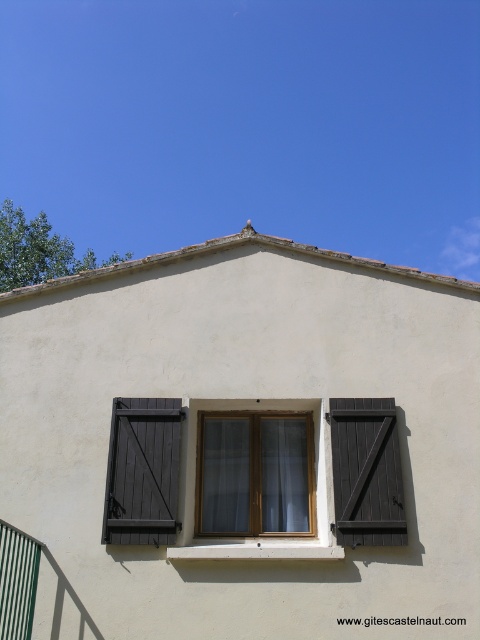
Question: Which point is farther to the camera?

Choices:
 (A) dark wood shutters at center
 (B) matte wood window at center
 (C) green striped rail at lower left
 (D) dark wood shutters at left

Answer: (B)

Question: Is dark wood shutters at center closer to camera compared to green striped rail at lower left?

Choices:
 (A) no
 (B) yes

Answer: (A)

Question: Does matte wood window at center have a larger size compared to green striped rail at lower left?

Choices:
 (A) yes
 (B) no

Answer: (A)

Question: Does matte wood window at center have a smaller size compared to dark wood shutters at center?

Choices:
 (A) yes
 (B) no

Answer: (B)

Question: Which is nearer to the matte wood window at center?

Choices:
 (A) dark wood shutters at left
 (B) dark wood shutters at center

Answer: (A)

Question: Which of the following is the farthest from the observer?

Choices:
 (A) (345, 477)
 (B) (283, 528)
 (C) (122, 465)

Answer: (B)